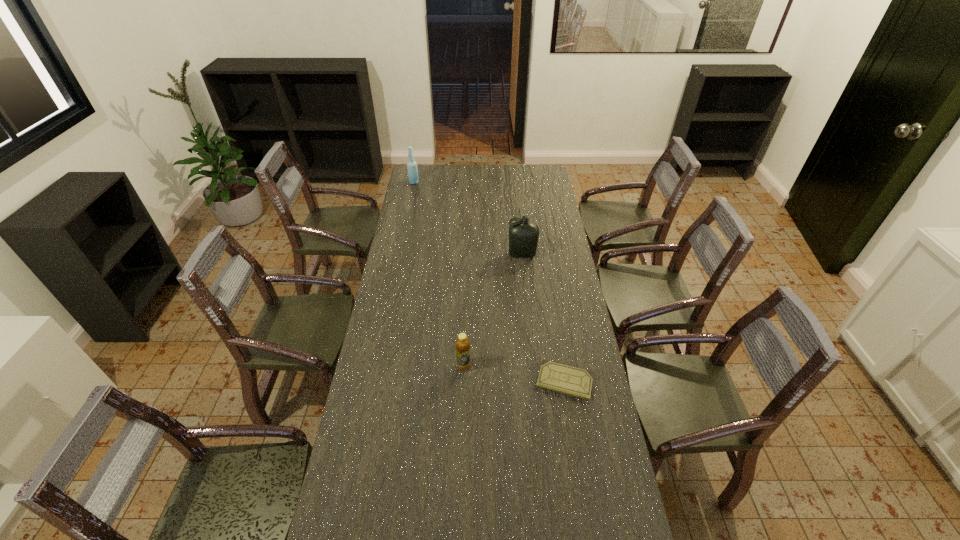
Where is `the leftmost object`? Image resolution: width=960 pixels, height=540 pixels. the leftmost object is located at coordinates (411, 164).

Where is `the farthest bottle`? the farthest bottle is located at coordinates (411, 164).

Locate an element on the screen. the rightmost bottle is located at coordinates (523, 235).

Find the location of `the second farthest bottle`. the second farthest bottle is located at coordinates (523, 235).

What are the coordinates of `the second shortest object` in the screenshot? It's located at (462, 344).

Find the location of `the third object from right to left`. the third object from right to left is located at coordinates (462, 344).

Image resolution: width=960 pixels, height=540 pixels. Find the location of `checkbook`. checkbook is located at coordinates (556, 377).

Locate an element on the screen. The height and width of the screenshot is (540, 960). blank area located on the front of the farthest object is located at coordinates (411, 198).

At what (x,y) coordinates should I click in order to perform the action: click on free space located on the front of the second farthest bottle. Please return your answer as a coordinate pair (x, y). The height and width of the screenshot is (540, 960). Looking at the image, I should click on (527, 302).

The width and height of the screenshot is (960, 540). Find the location of `vacant space positioned on the front of the second shortest object`. vacant space positioned on the front of the second shortest object is located at coordinates (463, 392).